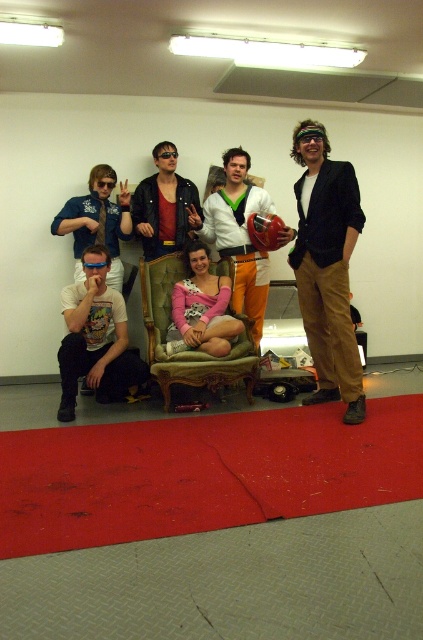
Question: Does matte black blazer at right have a lesser width compared to black plastic goggles at upper center?

Choices:
 (A) yes
 (B) no

Answer: (B)

Question: Can you confirm if matte white t-shirt at lower left is wider than tufted fabric armchair at center?

Choices:
 (A) yes
 (B) no

Answer: (B)

Question: Which object is closer to the camera taking this photo?

Choices:
 (A) pink satin dress at center
 (B) tufted fabric armchair at center
 (C) matte white shirt at center
 (D) matte black blazer at right

Answer: (D)

Question: Which of the following is the farthest from the observer?

Choices:
 (A) (327, 218)
 (B) (167, 156)
 (C) (200, 230)

Answer: (C)

Question: Among these points, which one is farthest from the camera?

Choices:
 (A) (87, 321)
 (B) (121, 221)

Answer: (B)

Question: Can you confirm if pink satin dress at center is wider than matte black jacket at center?

Choices:
 (A) no
 (B) yes

Answer: (A)